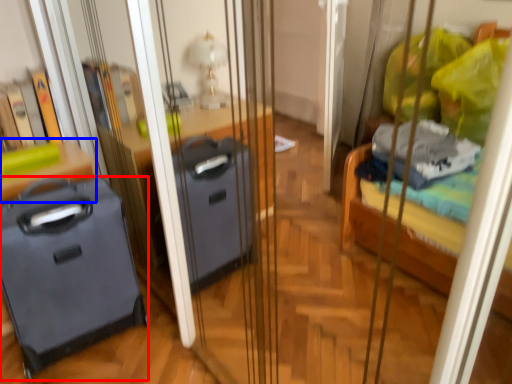
Question: Which object is closer to the camera taking this photo, luggage (highlighted by a red box) or furniture (highlighted by a blue box)?

Choices:
 (A) luggage
 (B) furniture

Answer: (A)